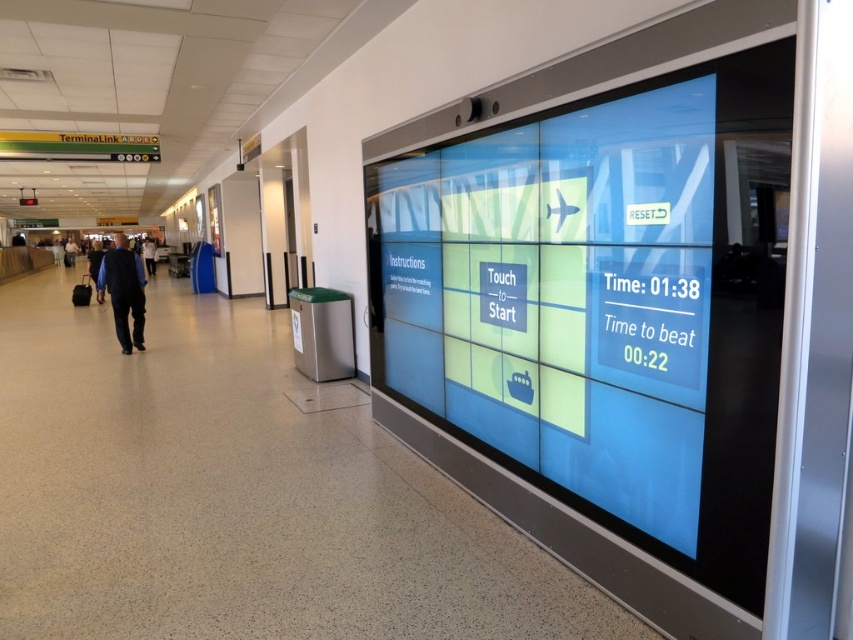
You are a traveler standing in the airport terminal hallway. You notice a blue glossy screen at right and a dark blue suit at left. Which object is wider from your perspective?

The blue glossy screen at right is wider than the dark blue suit at left according to the description.

You are a maintenance technician who needs to reach the blue glossy screen at right for cleaning. Your ladder can extend up to 1.5 meters. Can you safely reach the screen with your current ladder?

→ The blue glossy screen at right is 1.58 meters away from the camera. Since the ladder can only extend to 1.5 meters, it is 8 centimeters too short to safely reach the screen.

You are a traveler in an airport terminal and you want to locate the dark blue suit at left. Where should you look?

The dark blue suit at left is located at point 0.456 on the x axis and 0.145 on the y axis.